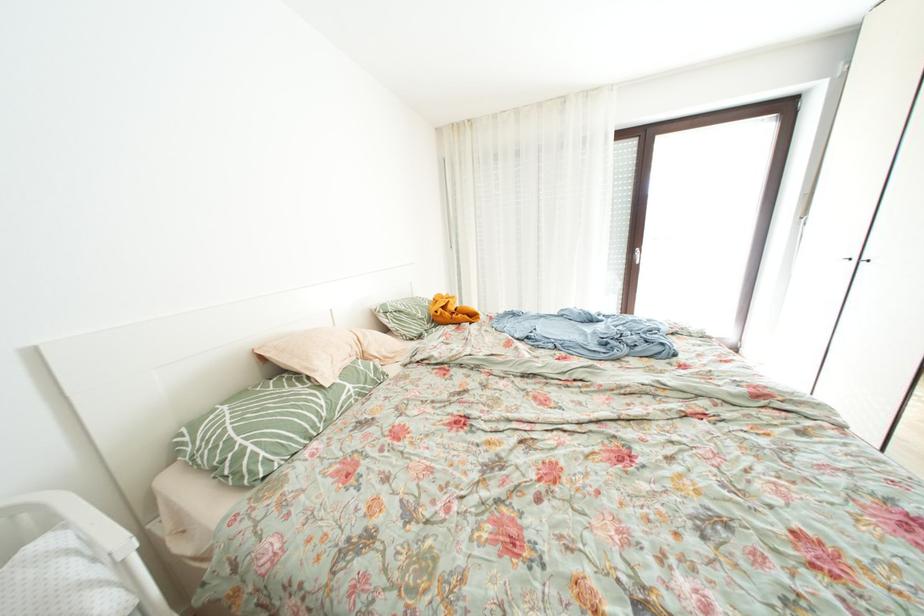
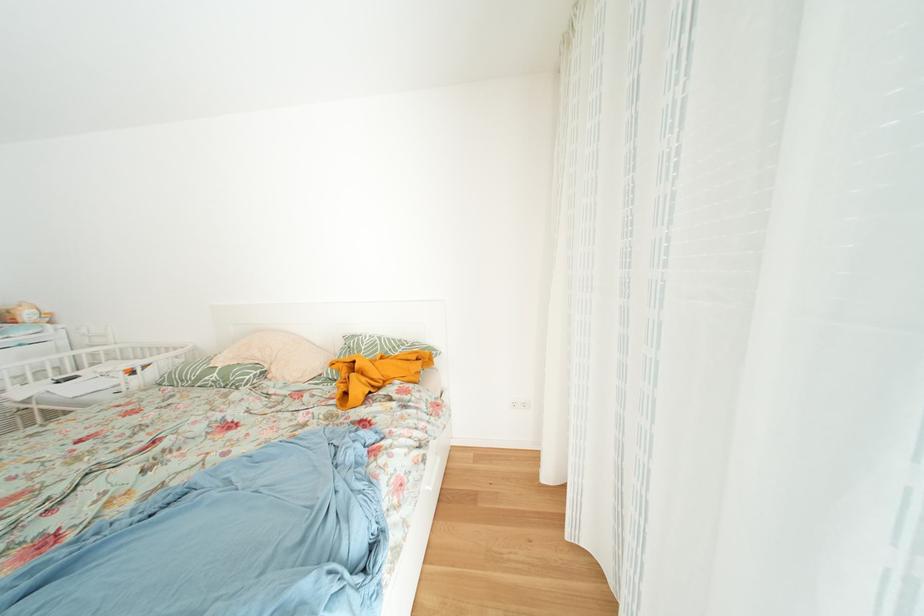
Where in the second image is the point corresponding to the point at 342,413 from the first image?

(208, 384)